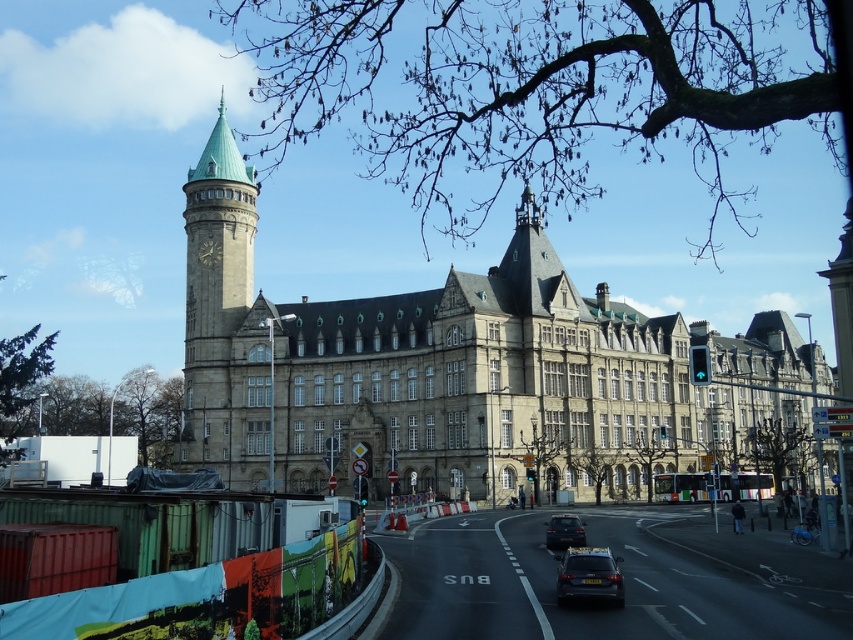
You are standing in front of the historic building and want to walk towards the two points marked on the road. Which point would you reach first, point (207, 282) or point (210, 266)?

You would reach point (207, 282) first because it is closer to you than point (210, 266).

You are a driver approaching the historic building and see the stone building at center and the shiny black sedan at center on the road. Which object takes up more horizontal space in the image?

The stone building at center has a larger width than the shiny black sedan at center, so it takes up more horizontal space in the image.

You are a tourist standing in front of the historic building and want to take a photo of both the green copper bell tower at upper left and the gold metallic clock at upper left. Since you have a wide angle lens, will you be able to capture both objects in the same frame?

The green copper bell tower at upper left is positioned over the gold metallic clock at upper left, so they are vertically aligned. With a wide angle lens, you should be able to capture both in the same frame as they are stacked on top of each other.